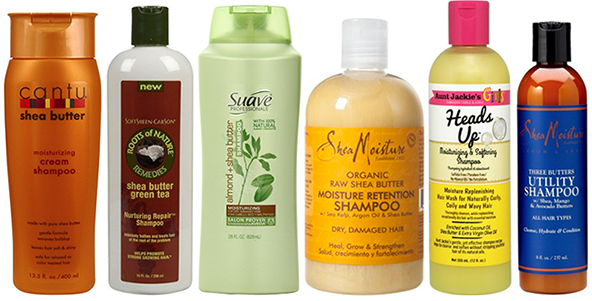
Where is `shampoo in bottles`? This screenshot has width=592, height=301. shampoo in bottles is located at coordinates (83, 186), (124, 188), (225, 217), (343, 233), (453, 238), (564, 255).